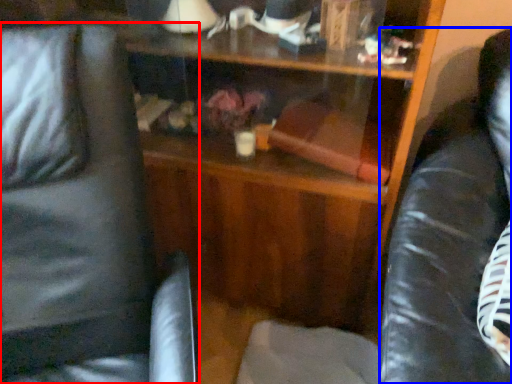
Question: Which of the following is the farthest to the observer, swivel chair (highlighted by a red box) or swivel chair (highlighted by a blue box)?

Choices:
 (A) swivel chair
 (B) swivel chair

Answer: (B)